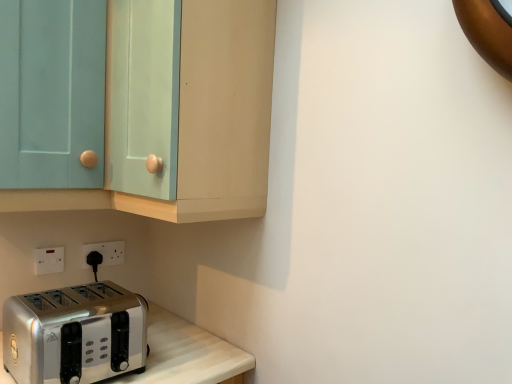
Where is `light blue glass door at upper left`? light blue glass door at upper left is located at coordinates (51, 92).

Measure the distance between point (133, 294) and camera.

Point (133, 294) is 4.04 feet away from camera.

In order to face white plastic electric outlet at lower left, arranged as the second electric outlet when viewed from the right, should I rotate leftwards or rightwards?

Rotate left and turn 25.850 degrees.

Identify the location of light blue glass door at upper left. pyautogui.click(x=51, y=92).

Is matte teal cabinet at upper left inside or outside of light blue glass door at upper left?

matte teal cabinet at upper left is spatially situated outside light blue glass door at upper left.

Can you confirm if matte teal cabinet at upper left is wider than light blue glass door at upper left?

Yes.

Locate an element on the screen. The image size is (512, 384). cabinetry above the light blue glass door at upper left (from a real-world perspective) is located at coordinates (203, 123).

From the image's perspective, would you say matte teal cabinet at upper left is positioned over light blue glass door at upper left?

Correct, matte teal cabinet at upper left appears higher than light blue glass door at upper left in the image.

From a real-world perspective, is light blue glass door at upper left located higher than white plastic electric outlet at lower left, the second electric outlet positioned from the back?

Yes, from a real-world perspective, light blue glass door at upper left is above white plastic electric outlet at lower left, the second electric outlet positioned from the back.

I want to click on glass door above the white plastic electric outlet at lower left, the 1th electric outlet when ordered from front to back (from the image's perspective), so click(51, 92).

Looking at their sizes, would you say light blue glass door at upper left is wider or thinner than white plastic electric outlet at lower left, arranged as the second electric outlet when viewed from the right?

Considering their sizes, light blue glass door at upper left looks broader than white plastic electric outlet at lower left, arranged as the second electric outlet when viewed from the right.

Who is shorter, light blue glass door at upper left or white plastic electric outlet at lower left, arranged as the second electric outlet when viewed from the right?

With less height is white plastic electric outlet at lower left, arranged as the second electric outlet when viewed from the right.

Is matte teal cabinet at upper left inside the boundaries of satin silver toaster at lower left, or outside?

→ matte teal cabinet at upper left is not enclosed by satin silver toaster at lower left.

Considering the points (229, 7) and (64, 362), which point is in front, point (229, 7) or point (64, 362)?

The point (229, 7) is in front.

Measure the distance from matte teal cabinet at upper left to satin silver toaster at lower left.

matte teal cabinet at upper left is 17.80 inches away from satin silver toaster at lower left.

Where is `the 1st electric outlet located above the satin silver toaster at lower left (from a real-world perspective)`? Image resolution: width=512 pixels, height=384 pixels. the 1st electric outlet located above the satin silver toaster at lower left (from a real-world perspective) is located at coordinates (105, 253).

Can you see white plastic electric outlet at lower left, which is the first electric outlet in back-to-front order, touching satin silver toaster at lower left?

white plastic electric outlet at lower left, which is the first electric outlet in back-to-front order, and satin silver toaster at lower left are clearly separated.

Find the location of `cabinetry that is above the white plastic electric outlet at lower left, arranged as the second electric outlet when viewed from the right (from a real-world perspective)`. cabinetry that is above the white plastic electric outlet at lower left, arranged as the second electric outlet when viewed from the right (from a real-world perspective) is located at coordinates (203, 123).

Looking at this image, from the image's perspective, relative to white plastic electric outlet at lower left, marked as the first electric outlet in a left-to-right arrangement, is matte teal cabinet at upper left above or below?

From the image's perspective, matte teal cabinet at upper left appears above white plastic electric outlet at lower left, marked as the first electric outlet in a left-to-right arrangement.

Considering the positions of point (41, 202) and point (58, 264), is point (41, 202) closer or farther from the camera than point (58, 264)?

Point (41, 202) appears to be closer to the viewer than point (58, 264).

Is matte teal cabinet at upper left with white plastic electric outlet at lower left, marked as the 2th electric outlet in a left-to-right arrangement?

No, matte teal cabinet at upper left is not making contact with white plastic electric outlet at lower left, marked as the 2th electric outlet in a left-to-right arrangement.

Is matte teal cabinet at upper left turned away from white plastic electric outlet at lower left, placed as the second electric outlet when sorted from front to back?

No, matte teal cabinet at upper left is not facing away from white plastic electric outlet at lower left, placed as the second electric outlet when sorted from front to back.

Is matte teal cabinet at upper left wider than white plastic electric outlet at lower left, marked as the 2th electric outlet in a left-to-right arrangement?

Indeed, matte teal cabinet at upper left has a greater width compared to white plastic electric outlet at lower left, marked as the 2th electric outlet in a left-to-right arrangement.

Can we say matte teal cabinet at upper left lies outside white plastic electric outlet at lower left, which is the first electric outlet in back-to-front order?

Absolutely, matte teal cabinet at upper left is external to white plastic electric outlet at lower left, which is the first electric outlet in back-to-front order.

Who is shorter, satin silver toaster at lower left or light blue glass door at upper left?

satin silver toaster at lower left.

Between satin silver toaster at lower left and light blue glass door at upper left, which one has larger width?

satin silver toaster at lower left is wider.

Is satin silver toaster at lower left inside the boundaries of light blue glass door at upper left, or outside?

satin silver toaster at lower left is not inside light blue glass door at upper left, it's outside.

Considering the points (37, 331) and (60, 87), which point is in front, point (37, 331) or point (60, 87)?

Positioned in front is point (37, 331).

This screenshot has height=384, width=512. Find the location of `cabinetry located above the light blue glass door at upper left (from a real-world perspective)`. cabinetry located above the light blue glass door at upper left (from a real-world perspective) is located at coordinates (203, 123).

Where is `glass door on the right of the white plastic electric outlet at lower left, the 1th electric outlet when ordered from front to back`? The image size is (512, 384). glass door on the right of the white plastic electric outlet at lower left, the 1th electric outlet when ordered from front to back is located at coordinates [x=51, y=92].

Looking at the image, which one is located closer to white plastic electric outlet at lower left, the first electric outlet when ordered from right to left, light blue glass door at upper left or matte teal cabinet at upper left?

The object closer to white plastic electric outlet at lower left, the first electric outlet when ordered from right to left, is light blue glass door at upper left.

When comparing their distances from light blue glass door at upper left, does white plastic electric outlet at lower left, arranged as the second electric outlet when viewed from the right, or white plastic electric outlet at lower left, marked as the 2th electric outlet in a left-to-right arrangement, seem further?

white plastic electric outlet at lower left, marked as the 2th electric outlet in a left-to-right arrangement, is further to light blue glass door at upper left.

Based on their spatial positions, is light blue glass door at upper left or matte teal cabinet at upper left further from white plastic electric outlet at lower left, the 1th electric outlet when ordered from front to back?

Based on the image, matte teal cabinet at upper left appears to be further to white plastic electric outlet at lower left, the 1th electric outlet when ordered from front to back.

Considering their positions, is white plastic electric outlet at lower left, the first electric outlet when ordered from right to left, positioned closer to white plastic electric outlet at lower left, the second electric outlet positioned from the back, than light blue glass door at upper left?

white plastic electric outlet at lower left, the first electric outlet when ordered from right to left.

Considering their positions, is white plastic electric outlet at lower left, the first electric outlet when ordered from right to left, positioned further to white plastic electric outlet at lower left, marked as the first electric outlet in a left-to-right arrangement, than matte teal cabinet at upper left?

matte teal cabinet at upper left lies further to white plastic electric outlet at lower left, marked as the first electric outlet in a left-to-right arrangement, than the other object.

Estimate the real-world distances between objects in this image. Which object is closer to satin silver toaster at lower left, matte teal cabinet at upper left or white plastic electric outlet at lower left, the second electric outlet positioned from the back?

white plastic electric outlet at lower left, the second electric outlet positioned from the back, lies closer to satin silver toaster at lower left than the other object.

From the image, which object appears to be farther from white plastic electric outlet at lower left, which is the first electric outlet in back-to-front order, satin silver toaster at lower left or white plastic electric outlet at lower left, marked as the first electric outlet in a left-to-right arrangement?

The object further to white plastic electric outlet at lower left, which is the first electric outlet in back-to-front order, is satin silver toaster at lower left.

Estimate the real-world distances between objects in this image. Which object is further from light blue glass door at upper left, satin silver toaster at lower left or matte teal cabinet at upper left?

Among the two, satin silver toaster at lower left is located further to light blue glass door at upper left.

Locate an element on the screen. glass door between matte teal cabinet at upper left and satin silver toaster at lower left from top to bottom is located at coordinates (51, 92).

Locate an element on the screen. The height and width of the screenshot is (384, 512). glass door between matte teal cabinet at upper left and white plastic electric outlet at lower left, marked as the first electric outlet in a left-to-right arrangement, along the z-axis is located at coordinates (51, 92).

I want to click on toaster between matte teal cabinet at upper left and white plastic electric outlet at lower left, which is the first electric outlet in back-to-front order, along the z-axis, so click(x=75, y=334).

Where is `glass door between matte teal cabinet at upper left and white plastic electric outlet at lower left, placed as the second electric outlet when sorted from front to back, in the front-back direction`? The width and height of the screenshot is (512, 384). glass door between matte teal cabinet at upper left and white plastic electric outlet at lower left, placed as the second electric outlet when sorted from front to back, in the front-back direction is located at coordinates (51, 92).